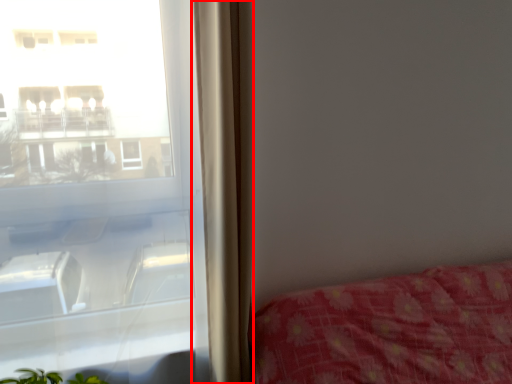
Question: From the image's perspective, what is the correct spatial relationship of curtain (annotated by the red box) in relation to window?

Choices:
 (A) above
 (B) below

Answer: (A)